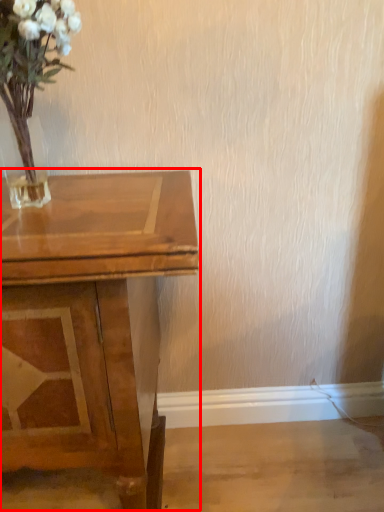
Question: From the image's perspective, what is the correct spatial relationship of table (annotated by the red box) in relation to floral arrangement?

Choices:
 (A) below
 (B) above

Answer: (A)